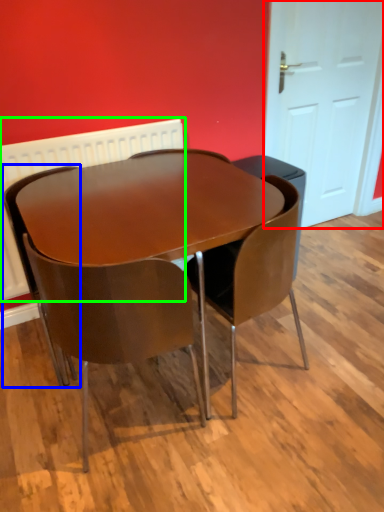
Question: Which is nearer to the door (highlighted by a red box)? chair (highlighted by a blue box) or radiator (highlighted by a green box).

Choices:
 (A) chair
 (B) radiator

Answer: (B)